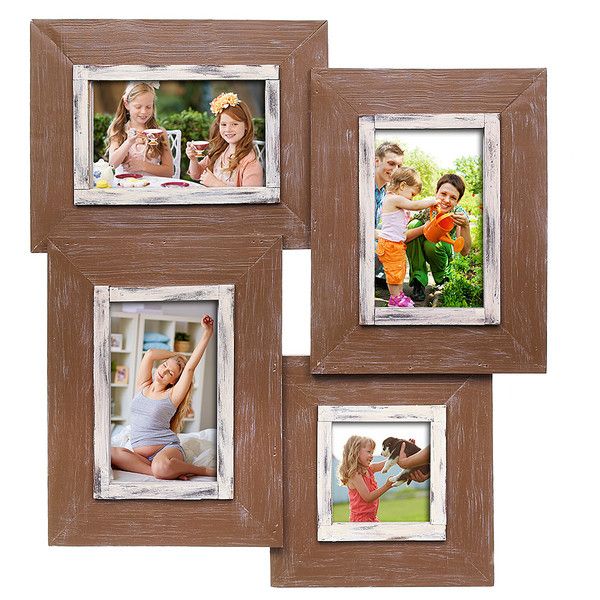
At what (x,y) coordinates should I click in order to perform the action: click on frames. Please return your answer as a coordinate pair (x, y). Looking at the image, I should click on (251, 258), (286, 205), (356, 98), (300, 385).